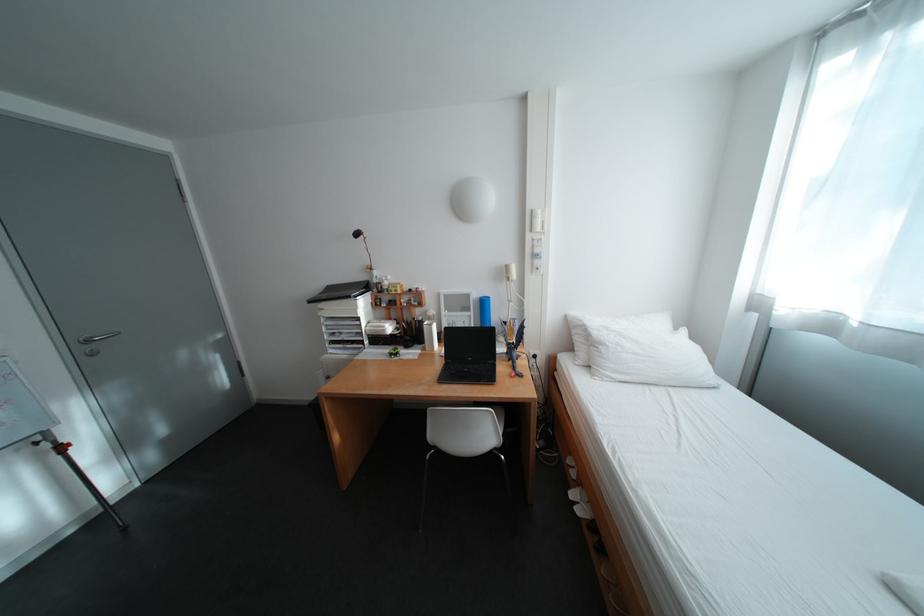
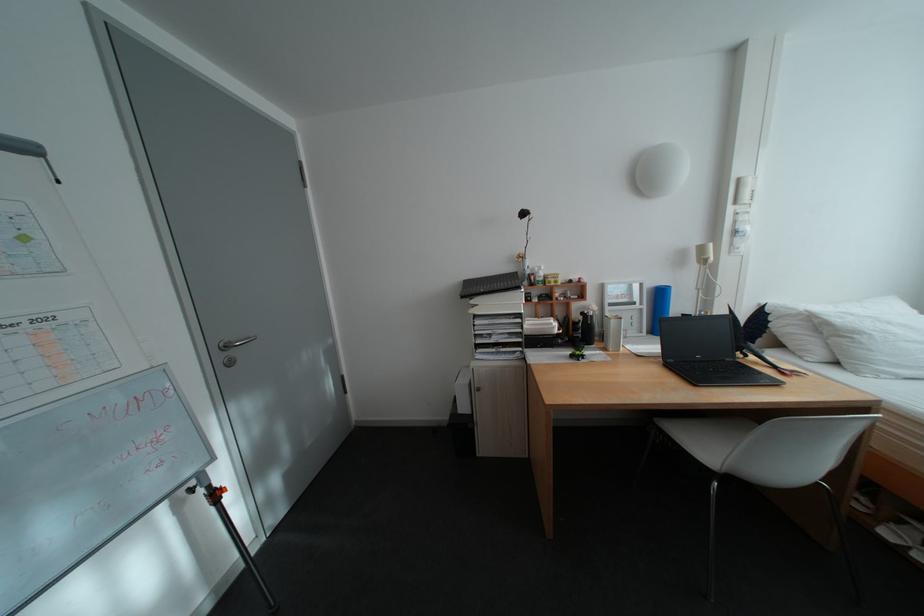
Locate, in the second image, the point that corresponds to (x=614, y=346) in the first image.

(871, 334)